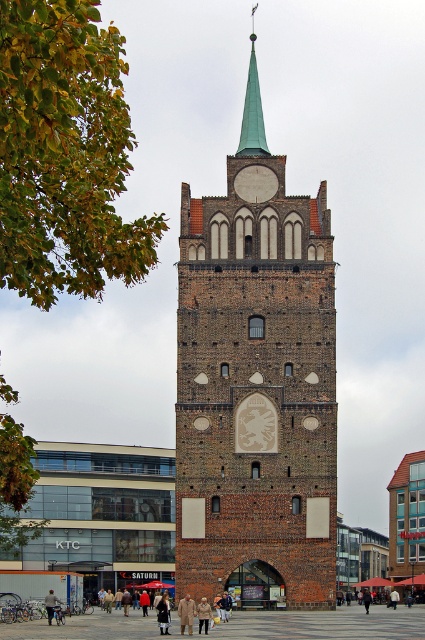
Question: Can you confirm if green polished metal spire at upper center is positioned to the left of khaki cotton pants at center?

Choices:
 (A) yes
 (B) no

Answer: (B)

Question: Which of the following is the closest to the observer?

Choices:
 (A) (54, 596)
 (B) (181, 600)
 (C) (260, 179)
 (D) (207, 620)

Answer: (D)

Question: Which object is positioned farthest from the matte stone clock at center?

Choices:
 (A) light brown leather coat at center
 (B) brown brick tower at center
 (C) green polished metal spire at upper center
 (D) brick pavement at center

Answer: (A)

Question: Is green polished metal spire at upper center smaller than brown leather jacket at lower center?

Choices:
 (A) no
 (B) yes

Answer: (A)

Question: Among these objects, which one is nearest to the camera?

Choices:
 (A) brown brick tower at center
 (B) brown leather jacket at lower center

Answer: (A)

Question: Is brown brick tower at center smaller than khaki cotton pants at center?

Choices:
 (A) no
 (B) yes

Answer: (A)